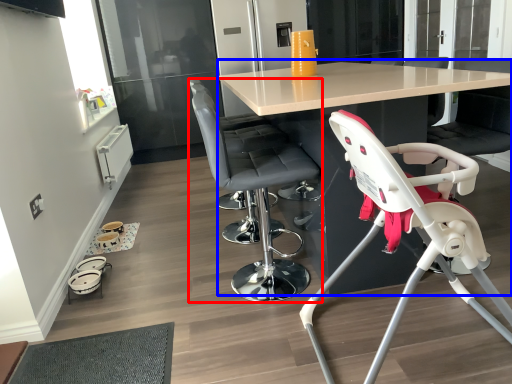
Question: Among these objects, which one is farthest to the camera, chair (highlighted by a red box) or table (highlighted by a blue box)?

Choices:
 (A) chair
 (B) table

Answer: (A)